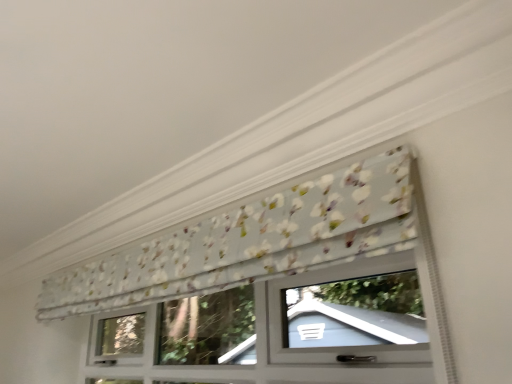
The width and height of the screenshot is (512, 384). Describe the element at coordinates (275, 289) in the screenshot. I see `floral fabric valance at upper center` at that location.

Measure the distance between point (143, 268) and camera.

Point (143, 268) is 1.69 meters away from camera.

At what (x,y) coordinates should I click in order to perform the action: click on floral fabric valance at upper center. Please return your answer as a coordinate pair (x, y). Looking at the image, I should click on (275, 289).

At what (x,y) coordinates should I click in order to perform the action: click on floral fabric valance at upper center. Please return your answer as a coordinate pair (x, y). The image size is (512, 384). Looking at the image, I should click on (275, 289).